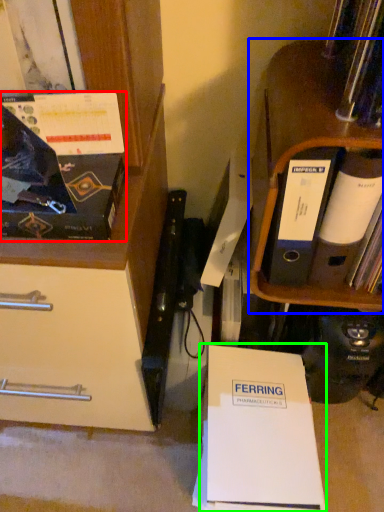
Question: Considering the real-world distances, which object is farthest from magazine (highlighted by a red box)? shelf (highlighted by a blue box) or paperback book (highlighted by a green box)?

Choices:
 (A) shelf
 (B) paperback book

Answer: (B)